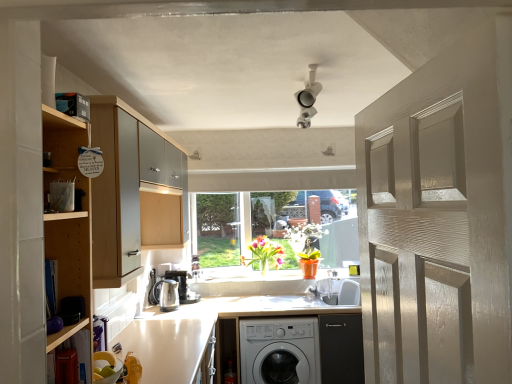
Question: From the image's perspective, relative to satin silver kettle at lower left, positioned as the first appliance in front-to-back order, is wooden cabinet at left, placed as the 2th cabinetry when sorted from front to back, above or below?

Choices:
 (A) below
 (B) above

Answer: (B)

Question: In terms of height, does wooden cabinet at left, the 1th cabinetry when ordered from back to front, look taller or shorter compared to satin silver kettle at lower left, placed as the second appliance when sorted from back to front?

Choices:
 (A) tall
 (B) short

Answer: (A)

Question: Which object is the farthest from the orange matte pot at center, which is counted as the second plant, starting from the left?

Choices:
 (A) translucent glass vase at center, arranged as the 1th plant when viewed from the left
 (B) matte white door at right
 (C) satin silver kettle at center, arranged as the 2th appliance when viewed from the front
 (D) wooden shelf at left, which appears as the 1th cabinetry when viewed from the front
 (E) satin silver kettle at lower left, placed as the second appliance when sorted from back to front

Answer: (B)

Question: Which object is the closest to the wooden shelf at left, which appears as the 1th cabinetry when viewed from the front?

Choices:
 (A) wooden cabinet at left, the 1th cabinetry when ordered from back to front
 (B) matte white door at right
 (C) white glossy countertop at lower center
 (D) satin silver kettle at lower left, positioned as the first appliance in front-to-back order
 (E) orange matte pot at center, the first plant in the right-to-left sequence

Answer: (A)